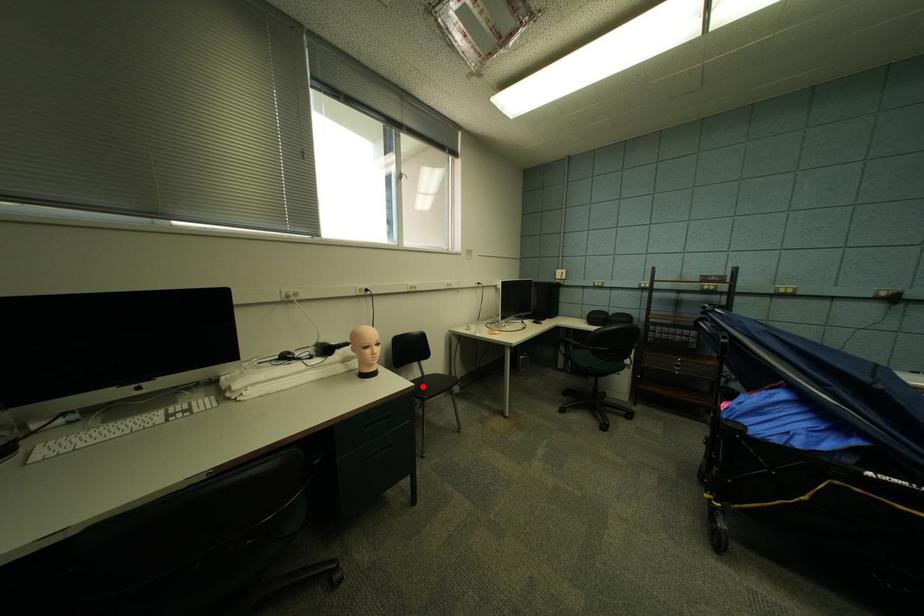
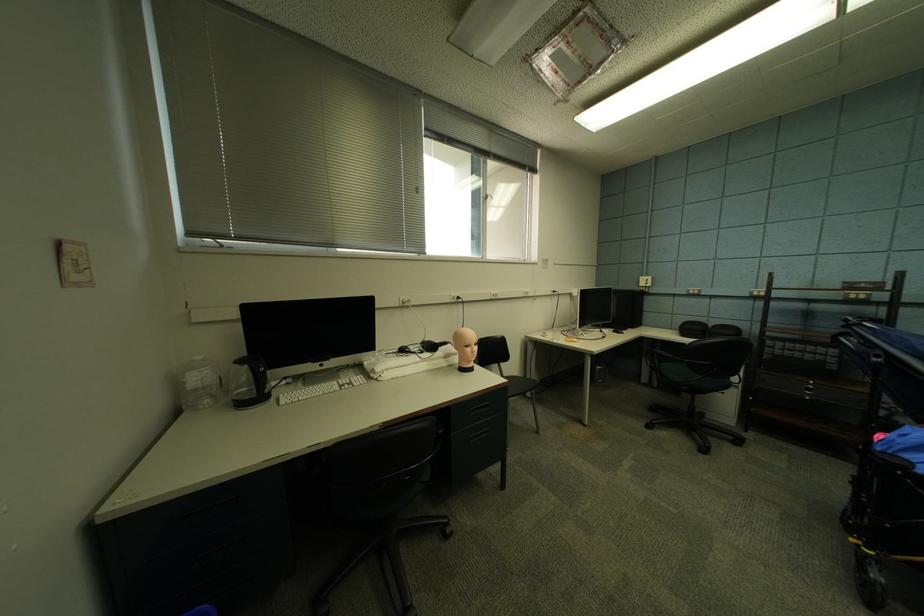
Find the pixel in the second image that matches the highlighted location in the first image.

(517, 382)